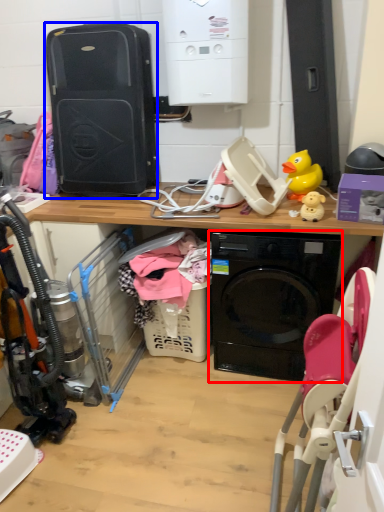
Question: Which object is further to the camera taking this photo, washing machine (highlighted by a red box) or computer tower (highlighted by a blue box)?

Choices:
 (A) washing machine
 (B) computer tower

Answer: (B)